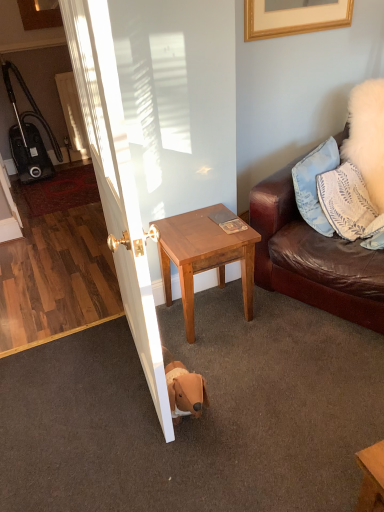
Where is `vacant space to the left of white glossy door at center`? This screenshot has width=384, height=512. vacant space to the left of white glossy door at center is located at coordinates (65, 385).